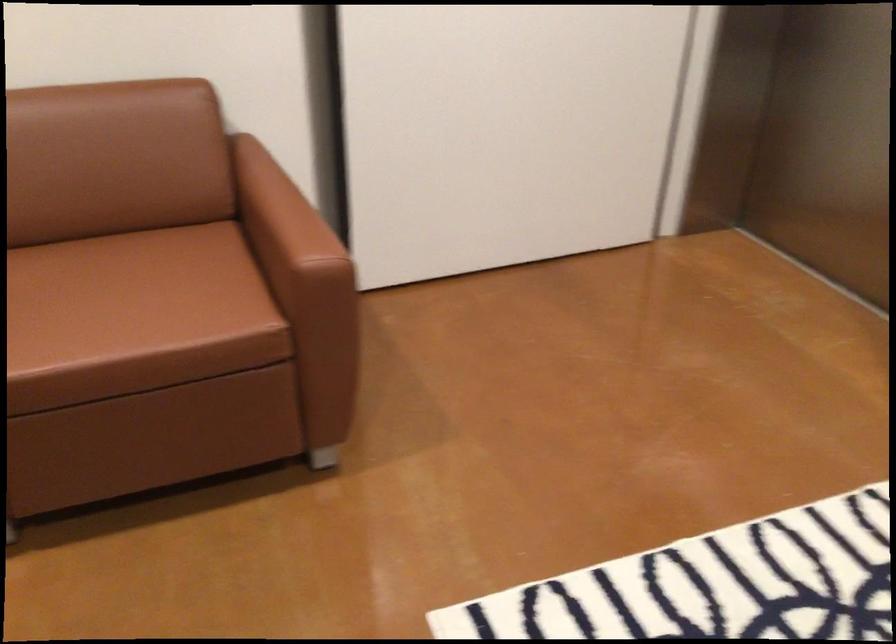
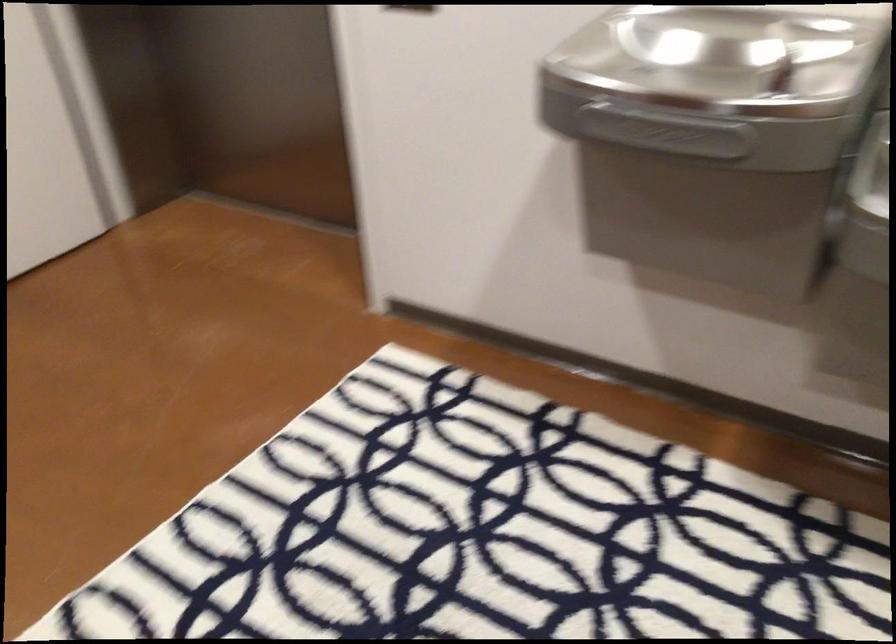
Question: The camera is either moving clockwise (left) or counter-clockwise (right) around the object. The first image is from the beginning of the video and the second image is from the end. Is the camera moving left or right when shooting the video?

Choices:
 (A) Left
 (B) Right

Answer: (A)